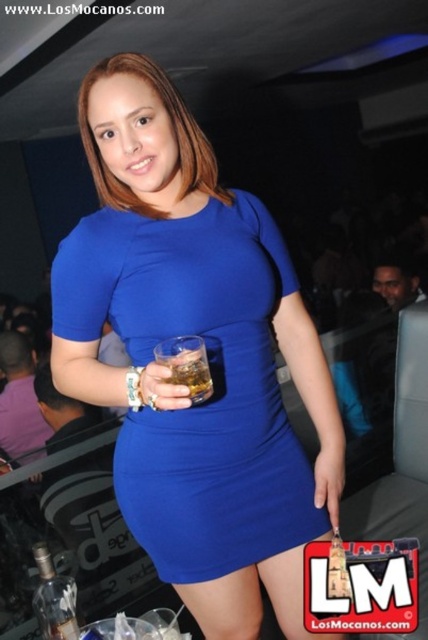
Between royal blue jersey dress at center and translucent glass at center, which one appears on the right side from the viewer's perspective?

Positioned to the right is royal blue jersey dress at center.

Which is more to the left, royal blue jersey dress at center or translucent glass at center?

translucent glass at center

What do you see at coordinates (211, 378) in the screenshot?
I see `royal blue jersey dress at center` at bounding box center [211, 378].

Locate an element on the screen. The image size is (428, 640). royal blue jersey dress at center is located at coordinates (211, 378).